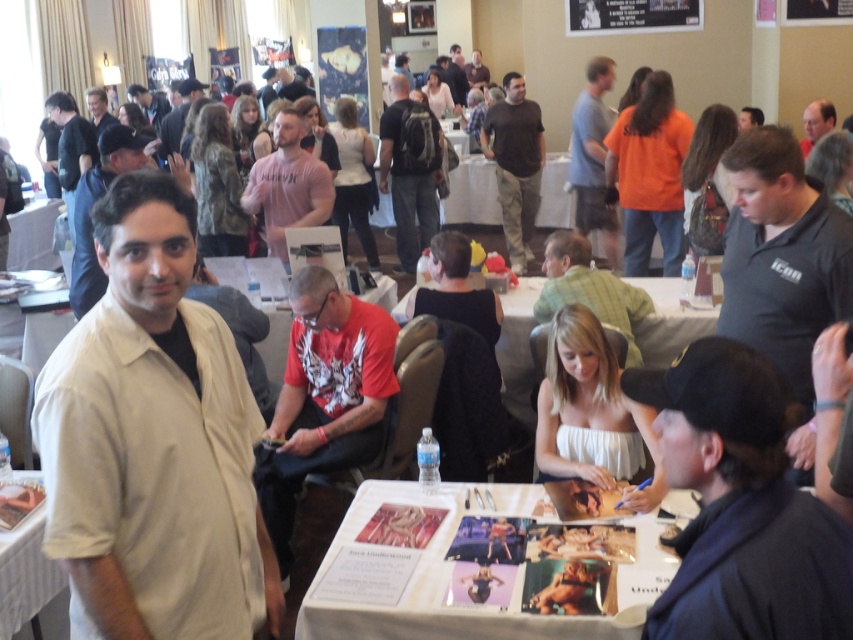
Question: Can you confirm if red t-shirt at center is positioned above pink cotton t-shirt at center?

Choices:
 (A) yes
 (B) no

Answer: (B)

Question: Can you confirm if matte beige shirt at center is thinner than matte black backpack at upper center?

Choices:
 (A) no
 (B) yes

Answer: (B)

Question: Which point is farther to the camera?

Choices:
 (A) black matte shirt at right
 (B) black cap at lower right
 (C) beige shirt at center

Answer: (A)

Question: Which point is closer to the camera?

Choices:
 (A) (125, 156)
 (B) (601, 202)
 (C) (283, 243)
 (D) (490, 150)

Answer: (A)

Question: Based on their relative distances, which object is nearer to the matte beige shirt at center?

Choices:
 (A) brown cotton shirt at center
 (B) white plastic table at center

Answer: (B)

Question: Does brown cotton shirt at center appear on the right side of dark gray shirt at upper left?

Choices:
 (A) yes
 (B) no

Answer: (A)